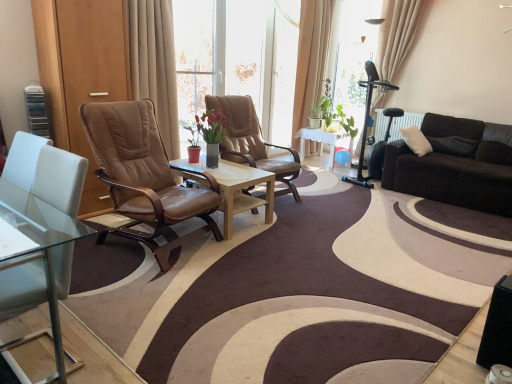
Describe the element at coordinates (354, 56) in the screenshot. I see `transparent glass window screen at upper center` at that location.

What do you see at coordinates (397, 35) in the screenshot?
I see `beige fabric curtain at upper right, arranged as the 2th curtain when viewed from the front` at bounding box center [397, 35].

Describe the element at coordinates (313, 57) in the screenshot. The width and height of the screenshot is (512, 384). I see `beige fabric curtain at upper center, the third curtain when ordered from front to back` at that location.

Where is `transparent glass window screen at upper center`? The image size is (512, 384). transparent glass window screen at upper center is located at coordinates (354, 56).

Which of these two, transparent glass window screen at upper center or beige fabric curtain at upper right, arranged as the 2th curtain when viewed from the front, is wider?

beige fabric curtain at upper right, arranged as the 2th curtain when viewed from the front.

In the scene shown: Which object is positioned more to the right, transparent glass window screen at upper center or beige fabric curtain at upper right, which is counted as the first curtain, starting from the right?

beige fabric curtain at upper right, which is counted as the first curtain, starting from the right.

Looking at this image, which object is more forward, transparent glass window screen at upper center or beige fabric curtain at upper right, which appears as the 3th curtain when viewed from the left?

beige fabric curtain at upper right, which appears as the 3th curtain when viewed from the left, is closer to the camera.

In terms of height, does transparent glass window screen at upper center look taller or shorter compared to beige fabric curtain at upper right, arranged as the 2th curtain when viewed from the front?

In the image, transparent glass window screen at upper center appears to be taller than beige fabric curtain at upper right, arranged as the 2th curtain when viewed from the front.

Can you confirm if white glossy table at center is thinner than green glossy plant at center?

In fact, white glossy table at center might be wider than green glossy plant at center.

Does point (320, 133) come in front of point (333, 113)?

Yes, it is in front of point (333, 113).

From the image's perspective, relative to green glossy plant at center, is white glossy table at center above or below?

white glossy table at center is situated lower than green glossy plant at center in the image.

Which curtain is the 1st one when counting from the right side of the brown leather chair at center, acting as the first chair starting from the front? Please provide its 2D coordinates.

[(313, 57)]

From a real-world perspective, between beige fabric curtain at upper center, the third curtain when ordered from front to back, and brown leather chair at center, acting as the first chair starting from the front, who is vertically higher?

beige fabric curtain at upper center, the third curtain when ordered from front to back.

From the image's perspective, is beige fabric curtain at upper center, the third curtain when ordered from front to back, below brown leather chair at center, the 2th chair when ordered from back to front?

No, from the image's perspective, beige fabric curtain at upper center, the third curtain when ordered from front to back, is not below brown leather chair at center, the 2th chair when ordered from back to front.

Who is more distant, beige fabric curtain at upper center, which is the 2th curtain from right to left, or brown leather chair at center, the 2th chair when ordered from back to front?

beige fabric curtain at upper center, which is the 2th curtain from right to left.

From a real-world perspective, is transparent glass coffee table at center, which is the 2th coffee table from right to left, located beneath beige fabric curtain at upper center, which is counted as the 1th curtain, starting from the back?

Yes, from a real-world perspective, transparent glass coffee table at center, which is the 2th coffee table from right to left, is below beige fabric curtain at upper center, which is counted as the 1th curtain, starting from the back.

From the image's perspective, would you say transparent glass coffee table at center, the first coffee table in the front-to-back sequence, is positioned over beige fabric curtain at upper center, the third curtain when ordered from front to back?

No, from the image's perspective, transparent glass coffee table at center, the first coffee table in the front-to-back sequence, is not over beige fabric curtain at upper center, the third curtain when ordered from front to back.

Is transparent glass coffee table at center, the second coffee table positioned from the back, far away from beige fabric curtain at upper center, which is counted as the 1th curtain, starting from the back?

That's right, there is a large distance between transparent glass coffee table at center, the second coffee table positioned from the back, and beige fabric curtain at upper center, which is counted as the 1th curtain, starting from the back.

Is transparent glass coffee table at center, which appears as the first coffee table when viewed from the left, not inside beige fabric curtain at upper center, the third curtain when ordered from front to back?

Indeed, transparent glass coffee table at center, which appears as the first coffee table when viewed from the left, is completely outside beige fabric curtain at upper center, the third curtain when ordered from front to back.

Would you say brown leather chair at center, the 2th chair when ordered from back to front, is to the left or to the right of transparent glass window screen at upper center in the picture?

brown leather chair at center, the 2th chair when ordered from back to front, is to the left of transparent glass window screen at upper center.

Which object is further away from the camera taking this photo, brown leather chair at center, the 2th chair when ordered from back to front, or transparent glass window screen at upper center?

transparent glass window screen at upper center is behind.

Who is shorter, brown leather chair at center, acting as the first chair starting from the front, or transparent glass window screen at upper center?

brown leather chair at center, acting as the first chair starting from the front.

From the picture: From the image's perspective, is brown leather chair at center, acting as the first chair starting from the front, located above transparent glass window screen at upper center?

No, from the image's perspective, brown leather chair at center, acting as the first chair starting from the front, is not over transparent glass window screen at upper center.

Can you confirm if green glossy plant at center is positioned to the left of light wood/woodenobject at center, placed as the first coffee table when sorted from back to front?

Incorrect, green glossy plant at center is not on the left side of light wood/woodenobject at center, placed as the first coffee table when sorted from back to front.

Looking at this image, can you see green glossy plant at center touching light wood/woodenobject at center, which is the second coffee table from front to back?

green glossy plant at center is not next to light wood/woodenobject at center, which is the second coffee table from front to back, and they're not touching.

Looking at this image, is green glossy plant at center looking in the opposite direction of light wood/woodenobject at center, placed as the first coffee table when sorted from back to front?

green glossy plant at center does not have its back to light wood/woodenobject at center, placed as the first coffee table when sorted from back to front.

Is brown leather chair at center, the 2th chair when ordered from back to front, next to beige fabric curtain at upper center, acting as the 1th curtain starting from the front, and touching it?

No, brown leather chair at center, the 2th chair when ordered from back to front, is not next to beige fabric curtain at upper center, acting as the 1th curtain starting from the front.

Which object is closer to the camera, brown leather chair at center, the 2th chair when ordered from back to front, or beige fabric curtain at upper center, arranged as the first curtain when viewed from the left?

brown leather chair at center, the 2th chair when ordered from back to front, is in front.

Does brown leather chair at center, acting as the first chair starting from the front, have a greater height compared to beige fabric curtain at upper center, arranged as the first curtain when viewed from the left?

Incorrect, the height of brown leather chair at center, acting as the first chair starting from the front, is not larger of that of beige fabric curtain at upper center, arranged as the first curtain when viewed from the left.

Locate an element on the screen. The image size is (512, 384). window screen above the beige fabric curtain at upper right, which is the 2th curtain in back-to-front order (from the image's perspective) is located at coordinates (354, 56).

What are the coordinates of `table located below the green glossy plant at center (from the image's perspective)` in the screenshot? It's located at (323, 141).

Which object lies nearer to the anchor point green glossy plant at center, transparent glass window screen at upper center or transparent glass coffee table at center, which is the 2th coffee table from right to left?

transparent glass window screen at upper center.

Which object lies nearer to the anchor point beige fabric curtain at upper center, the 2th curtain viewed from the left, transparent glass coffee table at center, the first coffee table in the front-to-back sequence, or beige fabric curtain at upper right, which is the 2th curtain in back-to-front order?

Answer: The object closer to beige fabric curtain at upper center, the 2th curtain viewed from the left, is beige fabric curtain at upper right, which is the 2th curtain in back-to-front order.

When comparing their distances from leather at center, which ranks as the first chair in back-to-front order, does white glossy table at center or transparent glass window screen at upper center seem closer?

white glossy table at center is positioned closer to the anchor leather at center, which ranks as the first chair in back-to-front order.

Based on their spatial positions, is transparent glass coffee table at center, which is the 2th coffee table from right to left, or beige fabric curtain at upper center, the 2th curtain viewed from the left, further from black leather couch at right?

transparent glass coffee table at center, which is the 2th coffee table from right to left.

Considering their positions, is black leather couch at right positioned closer to transparent glass coffee table at center, the first coffee table in the front-to-back sequence, than leather at center, the second chair in the front-to-back sequence?

The object closer to transparent glass coffee table at center, the first coffee table in the front-to-back sequence, is leather at center, the second chair in the front-to-back sequence.

Based on their spatial positions, is beige fabric curtain at upper right, arranged as the 2th curtain when viewed from the front, or brown leather chair at center, the 2th chair when ordered from back to front, closer to white glossy table at center?

beige fabric curtain at upper right, arranged as the 2th curtain when viewed from the front, lies closer to white glossy table at center than the other object.

In the scene shown: Looking at the image, which one is located further to light wood/woodenobject at center, placed as the first coffee table when sorted from back to front, transparent glass coffee table at center, which appears as the first coffee table when viewed from the left, or beige fabric curtain at upper right, which is counted as the first curtain, starting from the right?

The object further to light wood/woodenobject at center, placed as the first coffee table when sorted from back to front, is beige fabric curtain at upper right, which is counted as the first curtain, starting from the right.

When comparing their distances from brown leather chair at center, acting as the first chair starting from the front, does light wood/woodenobject at center, which is the first coffee table from right to left, or white glossy table at center seem closer?

Among the two, light wood/woodenobject at center, which is the first coffee table from right to left, is located nearer to brown leather chair at center, acting as the first chair starting from the front.

Find the location of `chair located between light wood/woodenobject at center, which is the first coffee table from right to left, and black leather couch at right in the left-right direction`. chair located between light wood/woodenobject at center, which is the first coffee table from right to left, and black leather couch at right in the left-right direction is located at coordinates click(x=252, y=141).

Identify the location of studio couch between leather at center, the second chair in the front-to-back sequence, and transparent glass window screen at upper center from front to back. Image resolution: width=512 pixels, height=384 pixels. (456, 166).

In order to click on plant between black leather couch at right and white glossy table at center from front to back in this screenshot , I will do `click(334, 113)`.

Where is `studio couch located between transparent glass coffee table at center, the first coffee table in the front-to-back sequence, and transparent glass window screen at upper center in the depth direction`? studio couch located between transparent glass coffee table at center, the first coffee table in the front-to-back sequence, and transparent glass window screen at upper center in the depth direction is located at coordinates (456, 166).